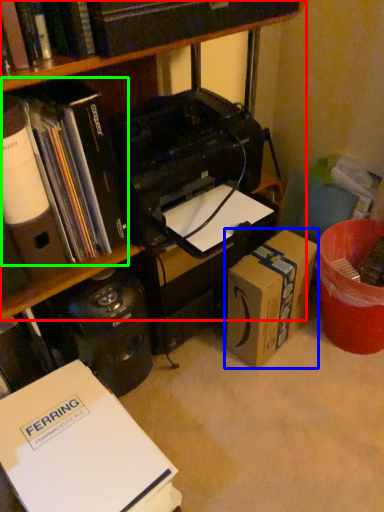
Question: Which object is the closest to the bookcase (highlighted by a red box)? Choose among these: box (highlighted by a blue box) or book (highlighted by a green box).

Choices:
 (A) box
 (B) book

Answer: (B)